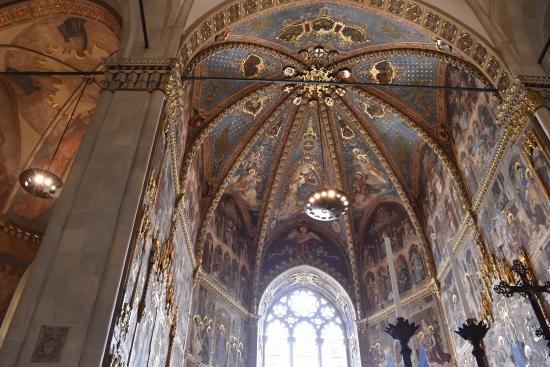
Identify the location of dome ceiling. Image resolution: width=550 pixels, height=367 pixels. (343, 44).